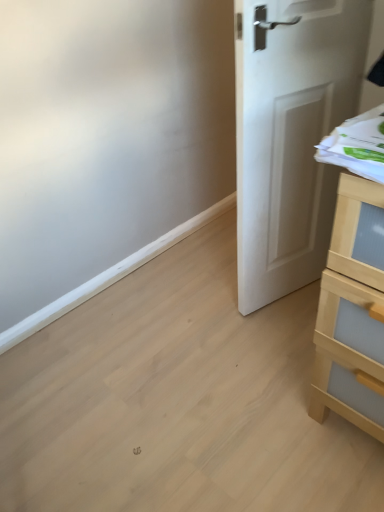
This screenshot has height=512, width=384. What are the coordinates of `vacant area situated to the left side of light wood chest of drawers at right` in the screenshot? It's located at (266, 410).